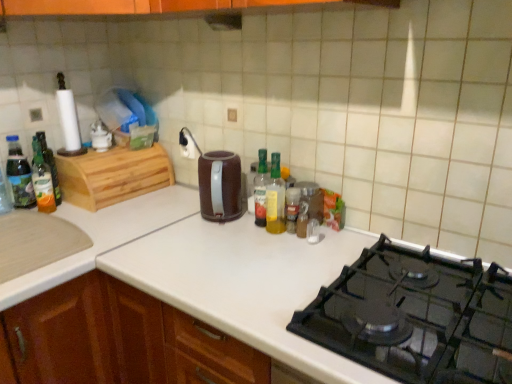
Question: From the image's perspective, is brown matte electric kettle at center beneath black matte gas stove at lower right?

Choices:
 (A) no
 (B) yes

Answer: (A)

Question: Can you confirm if brown matte electric kettle at center is positioned to the left of black matte gas stove at lower right?

Choices:
 (A) no
 (B) yes

Answer: (B)

Question: Is black matte gas stove at lower right located within brown matte electric kettle at center?

Choices:
 (A) yes
 (B) no

Answer: (B)

Question: Considering the relative sizes of brown matte electric kettle at center and black matte gas stove at lower right in the image provided, is brown matte electric kettle at center wider than black matte gas stove at lower right?

Choices:
 (A) yes
 (B) no

Answer: (B)

Question: Is the depth of brown matte electric kettle at center less than that of black matte gas stove at lower right?

Choices:
 (A) no
 (B) yes

Answer: (A)

Question: Is black plastic exhaust hood at upper center to the left or to the right of translucent plastic bottle at center, the 4th bottle positioned from the left, in the image?

Choices:
 (A) right
 (B) left

Answer: (B)

Question: Is black plastic exhaust hood at upper center spatially inside translucent plastic bottle at center, positioned as the second bottle in right-to-left order, or outside of it?

Choices:
 (A) outside
 (B) inside

Answer: (A)

Question: From the image's perspective, relative to translucent plastic bottle at center, positioned as the second bottle in right-to-left order, is black plastic exhaust hood at upper center above or below?

Choices:
 (A) above
 (B) below

Answer: (A)

Question: Based on their sizes in the image, would you say black plastic exhaust hood at upper center is bigger or smaller than translucent plastic bottle at center, positioned as the second bottle in right-to-left order?

Choices:
 (A) small
 (B) big

Answer: (A)

Question: Does point (239, 205) appear closer or farther from the camera than point (264, 200)?

Choices:
 (A) farther
 (B) closer

Answer: (A)

Question: From the image's perspective, is brown matte electric kettle at center located above or below translucent plastic bottle at center, the third bottle when ordered from left to right?

Choices:
 (A) above
 (B) below

Answer: (A)

Question: Relative to translucent plastic bottle at center, the third bottle when ordered from left to right, is brown matte electric kettle at center in front or behind?

Choices:
 (A) behind
 (B) front

Answer: (B)

Question: Looking at the image, does brown matte electric kettle at center seem bigger or smaller compared to translucent plastic bottle at center, positioned as the third bottle in right-to-left order?

Choices:
 (A) big
 (B) small

Answer: (A)

Question: Considering the relative positions of translucent plastic bottle at left, which is the first bottle from left to right, and translucent plastic bottle at center, the third bottle when ordered from left to right, in the image provided, is translucent plastic bottle at left, which is the first bottle from left to right, to the left or to the right of translucent plastic bottle at center, the third bottle when ordered from left to right,?

Choices:
 (A) left
 (B) right

Answer: (A)

Question: Which is correct: translucent plastic bottle at left, which is the first bottle from left to right, is inside translucent plastic bottle at center, the third bottle when ordered from left to right, or outside of it?

Choices:
 (A) inside
 (B) outside

Answer: (B)